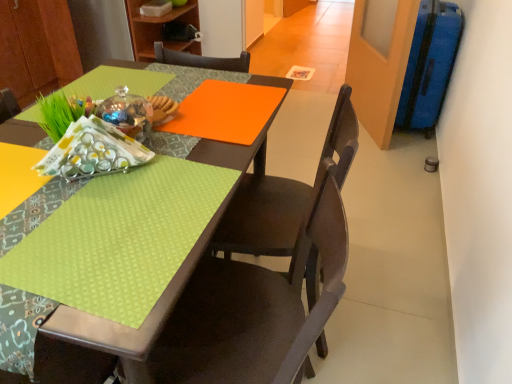
Question: From the image's perspective, is wooden bookshelf at upper center above or below matte brown chair at lower center, acting as the 1th chair starting from the front?

Choices:
 (A) below
 (B) above

Answer: (B)

Question: From a real-world perspective, is wooden bookshelf at upper center above or below matte brown chair at lower center, acting as the 1th chair starting from the front?

Choices:
 (A) above
 (B) below

Answer: (A)

Question: Considering the real-world distances, which object is closest to the wooden bookshelf at upper center?

Choices:
 (A) matte brown chair at lower center, acting as the 1th chair starting from the front
 (B) lime green fabric at lower left
 (C) blue textured suitcase at right
 (D) matte dark wood chair at center, which ranks as the second chair in front-to-back order

Answer: (C)

Question: Estimate the real-world distances between objects in this image. Which object is farther from the lime green fabric at lower left?

Choices:
 (A) matte dark wood chair at center, which ranks as the second chair in front-to-back order
 (B) wooden bookshelf at upper center
 (C) blue textured suitcase at right
 (D) matte brown chair at lower center, the second chair in the back-to-front sequence

Answer: (B)